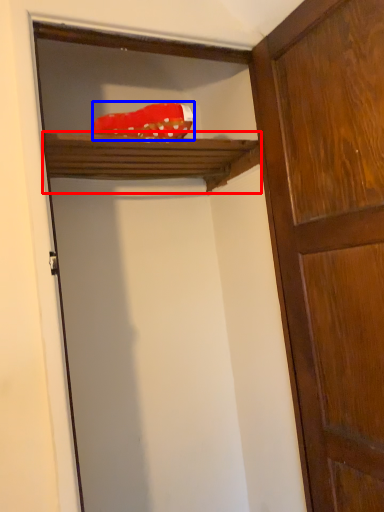
Question: Which object appears closest to the camera in this image, shelf (highlighted by a red box) or material (highlighted by a blue box)?

Choices:
 (A) shelf
 (B) material

Answer: (B)